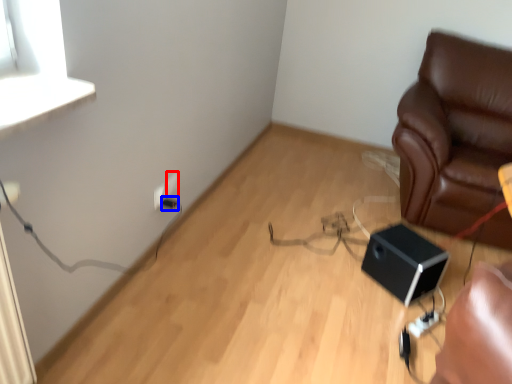
Question: Which object appears farthest to the camera in this image, electric outlet (highlighted by a red box) or electric outlet (highlighted by a blue box)?

Choices:
 (A) electric outlet
 (B) electric outlet

Answer: (A)